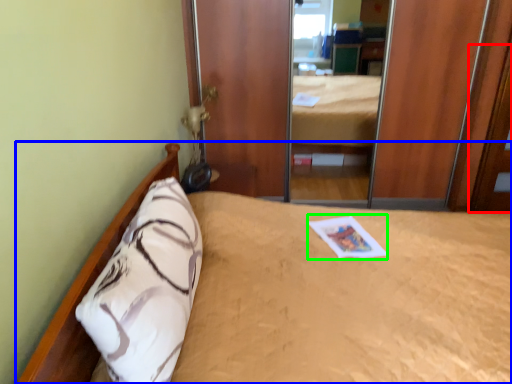
Question: Based on their relative distances, which object is nearer to door (highlighted by a red box)? Choose from bed (highlighted by a blue box) and magazine (highlighted by a green box).

Choices:
 (A) bed
 (B) magazine

Answer: (B)